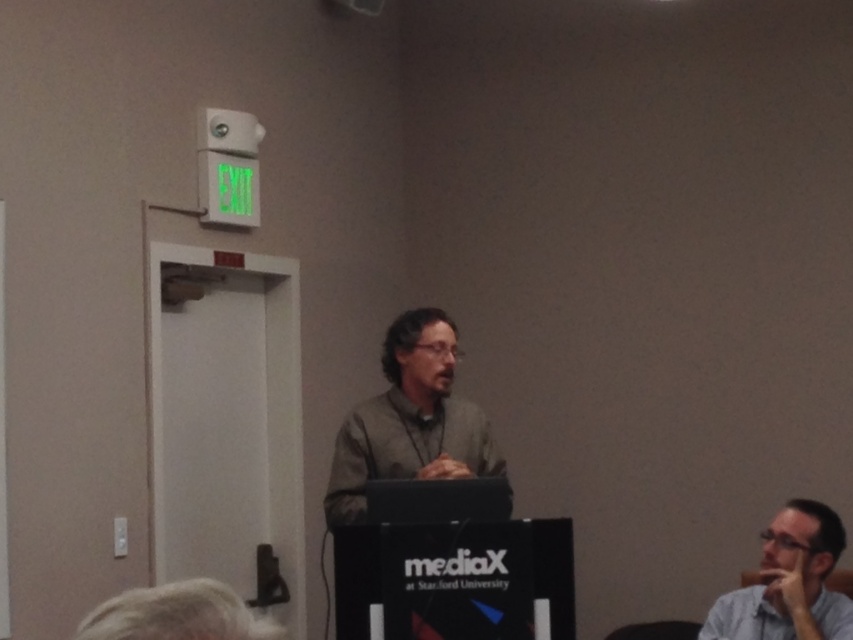
Can you confirm if matte gray shirt at center is wider than light blue shirt at lower right?

Indeed, matte gray shirt at center has a greater width compared to light blue shirt at lower right.

Which is more to the right, matte gray shirt at center or light blue shirt at lower right?

From the viewer's perspective, light blue shirt at lower right appears more on the right side.

Describe the element at coordinates (410, 420) in the screenshot. I see `matte gray shirt at center` at that location.

The width and height of the screenshot is (853, 640). Find the location of `matte gray shirt at center`. matte gray shirt at center is located at coordinates (410, 420).